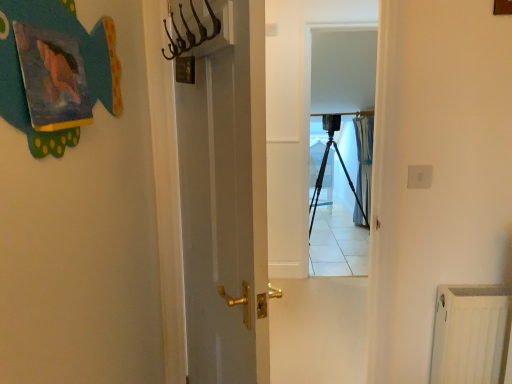
Question: Choose the correct answer: Is black matte tripod at center inside blue sheer curtain at center or outside it?

Choices:
 (A) outside
 (B) inside

Answer: (A)

Question: From the image's perspective, relative to blue sheer curtain at center, is black matte tripod at center above or below?

Choices:
 (A) above
 (B) below

Answer: (B)

Question: Based on their relative distances, which object is nearer to the blue sheer curtain at center?

Choices:
 (A) white textured radiator at lower right
 (B) white glossy screen door at center, the second screen door viewed from the back
 (C) black matte tripod at center
 (D) white plastic electric outlet at upper right
 (E) transparent plastic screen door at center, the 1th screen door when ordered from back to front

Answer: (C)

Question: Which is nearer to the white plastic electric outlet at upper right?

Choices:
 (A) transparent plastic screen door at center, placed as the 2th screen door when sorted from left to right
 (B) black matte tripod at center
 (C) blue sheer curtain at center
 (D) white textured radiator at lower right
 (E) white glossy screen door at center, the 1th screen door in the front-to-back sequence

Answer: (D)